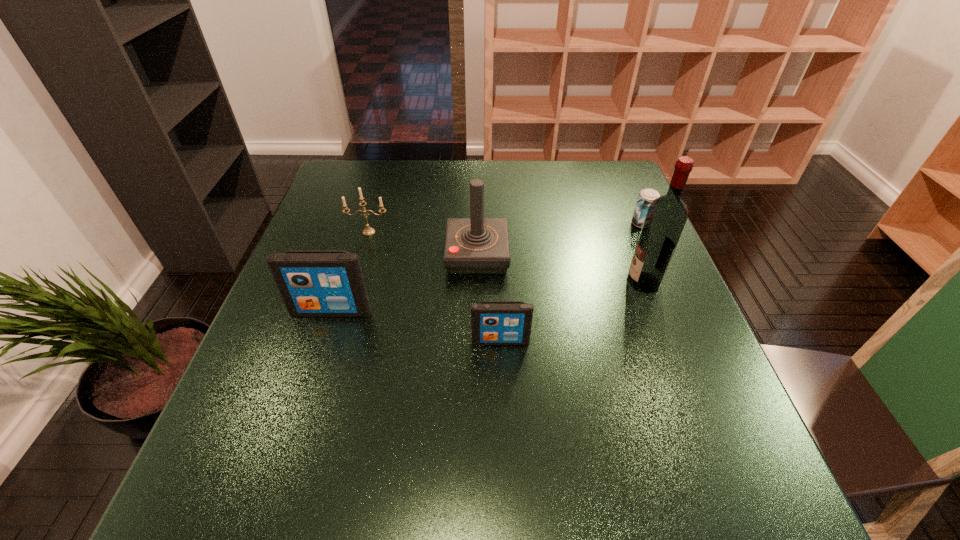
Locate an element on the screen. This screenshot has height=540, width=960. free space located on the rectangular base of the fifth shortest object is located at coordinates (556, 255).

The height and width of the screenshot is (540, 960). In order to click on free region located 0.260m on the left of the beer can in this screenshot , I will do `click(536, 224)`.

Find the location of a particular element. This screenshot has height=540, width=960. free spot located on the front and back of the tallest object is located at coordinates (546, 282).

The height and width of the screenshot is (540, 960). Identify the location of free space located on the front and back of the tallest object. (483, 282).

The height and width of the screenshot is (540, 960). I want to click on vacant region located 0.050m on the front and back of the tallest object, so point(606,282).

Locate an element on the screen. This screenshot has width=960, height=540. vacant area situated 0.210m on the right of the candle is located at coordinates (468, 232).

I want to click on iPod present at the left edge, so click(313, 283).

You are a GUI agent. You are given a task and a screenshot of the screen. Output one action in this format:
    pyautogui.click(x=<x>, y=<y>)
    Task: Click on the candle that is at the left edge
    The width and height of the screenshot is (960, 540).
    Given the screenshot: What is the action you would take?
    pyautogui.click(x=368, y=231)

Image resolution: width=960 pixels, height=540 pixels. I want to click on beer can that is at the right edge, so click(646, 196).

At what (x,y) coordinates should I click in order to perform the action: click on alcohol at the right edge. Please return your answer as a coordinate pair (x, y). Image resolution: width=960 pixels, height=540 pixels. Looking at the image, I should click on (665, 219).